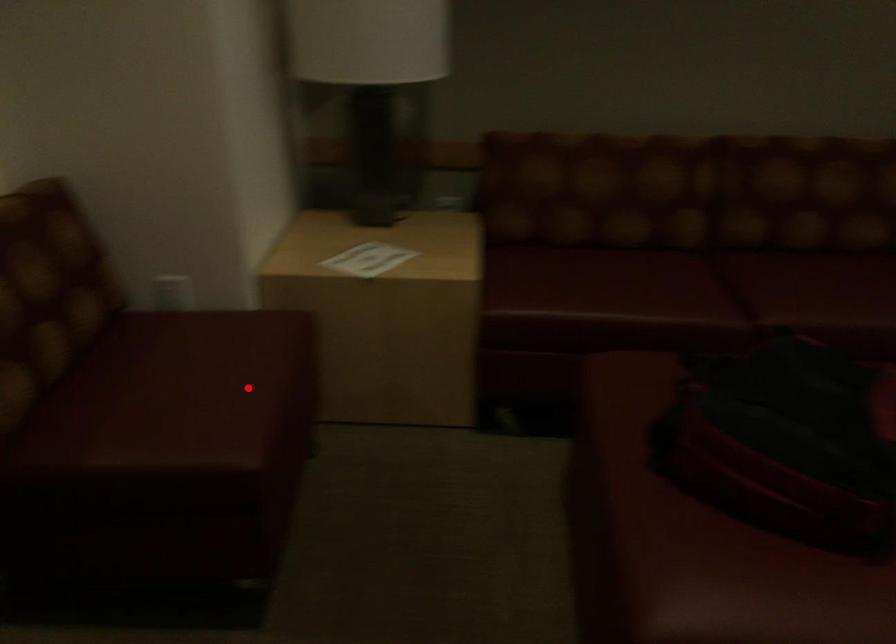
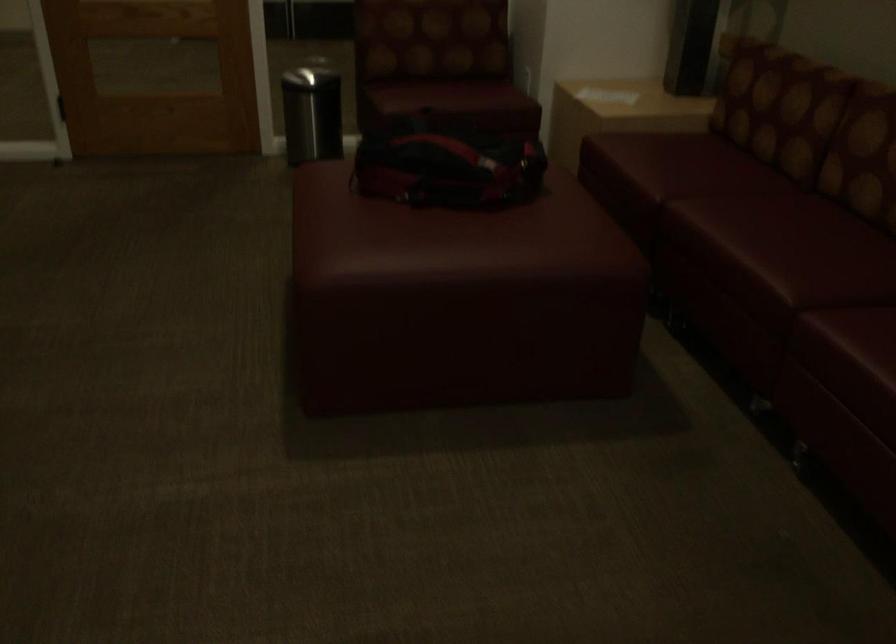
Question: I am providing you with two images of the same scene from different viewpoints. Given a red point in image1, look at the same physical point in image2. Is it:

Choices:
 (A) Closer to the viewpoint
 (B) Farther from the viewpoint

Answer: (B)